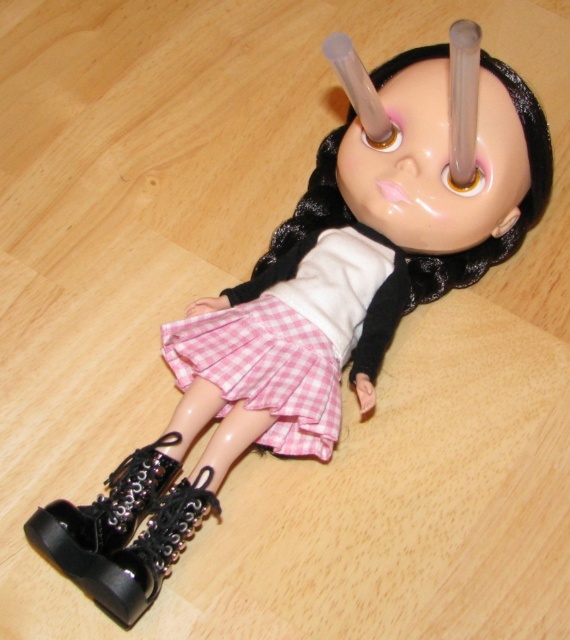
Question: Can you confirm if pink checkered skirt at center is thinner than black leather boot at lower left?

Choices:
 (A) yes
 (B) no

Answer: (B)

Question: Which of the following is the farthest from the observer?

Choices:
 (A) pyautogui.click(x=177, y=371)
 (B) pyautogui.click(x=135, y=518)

Answer: (A)

Question: Observing the image, what is the correct spatial positioning of pink checkered skirt at center in reference to black leather boot at lower left?

Choices:
 (A) left
 (B) right

Answer: (B)

Question: Which of the following is the closest to the observer?

Choices:
 (A) black leather boot at lower left
 (B) pink checkered skirt at center

Answer: (A)

Question: Which point is farther to the camera?

Choices:
 (A) pink checkered skirt at center
 (B) black leather boot at lower left

Answer: (A)

Question: Does pink checkered skirt at center appear on the left side of black leather boot at lower left?

Choices:
 (A) no
 (B) yes

Answer: (A)